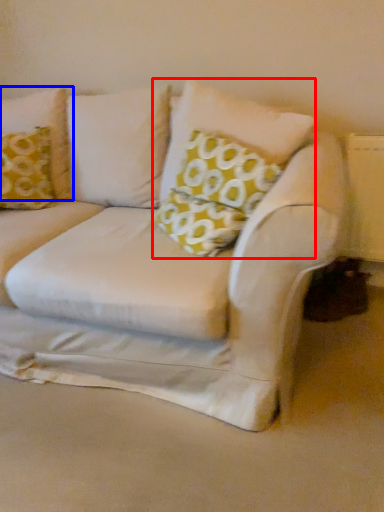
Question: Which object appears farthest to the camera in this image, pillow (highlighted by a red box) or pillow (highlighted by a blue box)?

Choices:
 (A) pillow
 (B) pillow

Answer: (B)